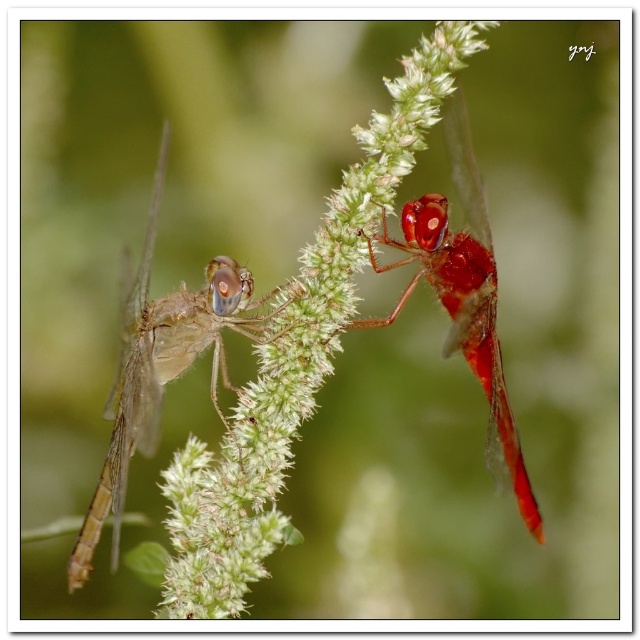
Question: Does green fuzzy plant at center lie behind shiny red dragonfly at upper right?

Choices:
 (A) yes
 (B) no

Answer: (A)

Question: Which is farther from the translucent brown dragonfly at left?

Choices:
 (A) shiny red dragonfly at upper right
 (B) green fuzzy plant at center

Answer: (A)

Question: Among these objects, which one is nearest to the camera?

Choices:
 (A) shiny red dragonfly at upper right
 (B) green fuzzy plant at center

Answer: (A)

Question: Which of the following is the farthest from the observer?

Choices:
 (A) green fuzzy plant at center
 (B) translucent brown dragonfly at left
 (C) shiny red dragonfly at upper right

Answer: (A)

Question: In this image, where is green fuzzy plant at center located relative to shiny red dragonfly at upper right?

Choices:
 (A) left
 (B) right

Answer: (A)

Question: Where is translucent brown dragonfly at left located in relation to shiny red dragonfly at upper right in the image?

Choices:
 (A) below
 (B) above

Answer: (A)